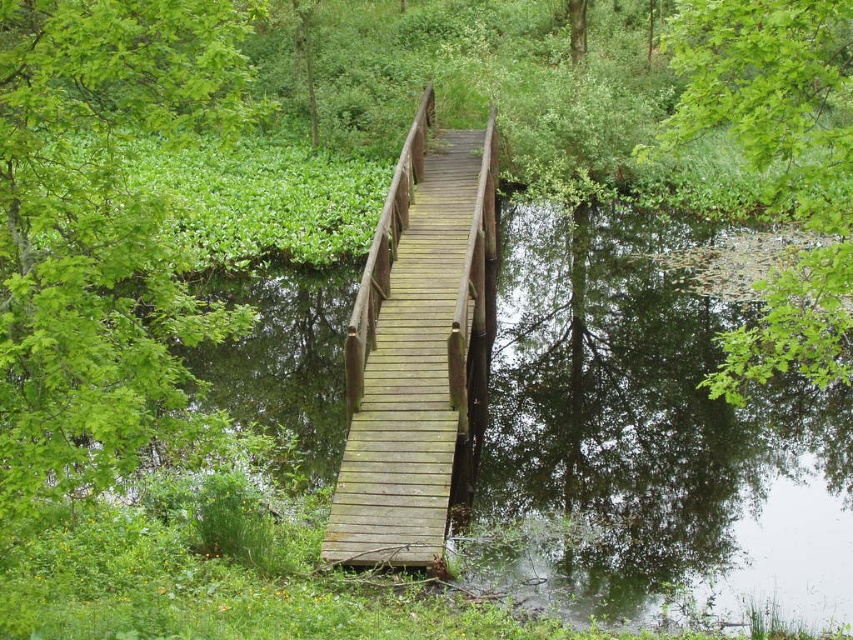
Question: Which object is farther from the camera taking this photo?

Choices:
 (A) wooden bridge at center
 (B) green leafy tree at upper left
 (C) green leafy tree at upper right

Answer: (A)

Question: Can you confirm if green leafy tree at upper left is smaller than wooden bridge at center?

Choices:
 (A) yes
 (B) no

Answer: (A)

Question: Can you confirm if wooden bridge at center is positioned to the right of green leafy tree at upper right?

Choices:
 (A) no
 (B) yes

Answer: (A)

Question: Which point is closer to the camera?

Choices:
 (A) (773, 321)
 (B) (78, 26)
 (C) (473, 259)

Answer: (B)

Question: Is wooden bridge at center to the left of green leafy tree at upper right from the viewer's perspective?

Choices:
 (A) yes
 (B) no

Answer: (A)

Question: Based on their relative distances, which object is nearer to the wooden bridge at center?

Choices:
 (A) green leafy tree at upper right
 (B) green leafy tree at upper left

Answer: (A)